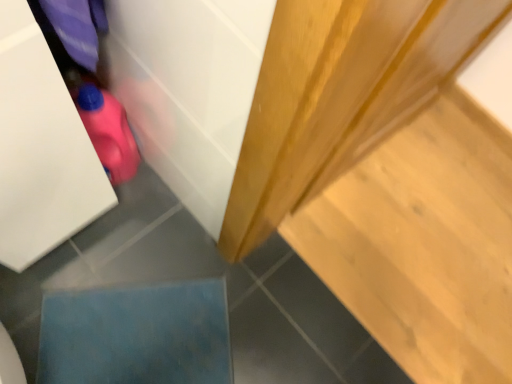
Question: Is light wood stair at upper right at the right side of blue fabric at lower left?

Choices:
 (A) yes
 (B) no

Answer: (A)

Question: Considering the relative sizes of light wood stair at upper right and blue fabric at lower left in the image provided, is light wood stair at upper right smaller than blue fabric at lower left?

Choices:
 (A) no
 (B) yes

Answer: (A)

Question: Is light wood stair at upper right in front of blue fabric at lower left?

Choices:
 (A) no
 (B) yes

Answer: (A)

Question: From the image's perspective, is light wood stair at upper right located beneath blue fabric at lower left?

Choices:
 (A) yes
 (B) no

Answer: (B)

Question: Is light wood stair at upper right positioned beyond the bounds of blue fabric at lower left?

Choices:
 (A) yes
 (B) no

Answer: (A)

Question: Considering the positions of pink rubber toy at lower left and blue fabric at lower left in the image, is pink rubber toy at lower left wider or thinner than blue fabric at lower left?

Choices:
 (A) thin
 (B) wide

Answer: (A)

Question: From their relative heights in the image, would you say pink rubber toy at lower left is taller or shorter than blue fabric at lower left?

Choices:
 (A) short
 (B) tall

Answer: (B)

Question: Considering the relative positions of pink rubber toy at lower left and blue fabric at lower left in the image provided, is pink rubber toy at lower left to the left or to the right of blue fabric at lower left?

Choices:
 (A) left
 (B) right

Answer: (A)

Question: Is pink rubber toy at lower left situated inside blue fabric at lower left or outside?

Choices:
 (A) outside
 (B) inside

Answer: (A)

Question: Is blue fabric at lower left in front of or behind pink rubber toy at lower left in the image?

Choices:
 (A) front
 (B) behind

Answer: (B)

Question: From the image's perspective, is blue fabric at lower left positioned above or below pink rubber toy at lower left?

Choices:
 (A) below
 (B) above

Answer: (A)

Question: Considering the positions of point (158, 365) and point (82, 122), is point (158, 365) closer or farther from the camera than point (82, 122)?

Choices:
 (A) farther
 (B) closer

Answer: (A)

Question: Based on their sizes in the image, would you say blue fabric at lower left is bigger or smaller than pink rubber toy at lower left?

Choices:
 (A) big
 (B) small

Answer: (B)

Question: From the image's perspective, relative to light wood stair at upper right, is blue fabric at lower left above or below?

Choices:
 (A) below
 (B) above

Answer: (A)

Question: From a real-world perspective, relative to light wood stair at upper right, is blue fabric at lower left vertically above or below?

Choices:
 (A) above
 (B) below

Answer: (A)